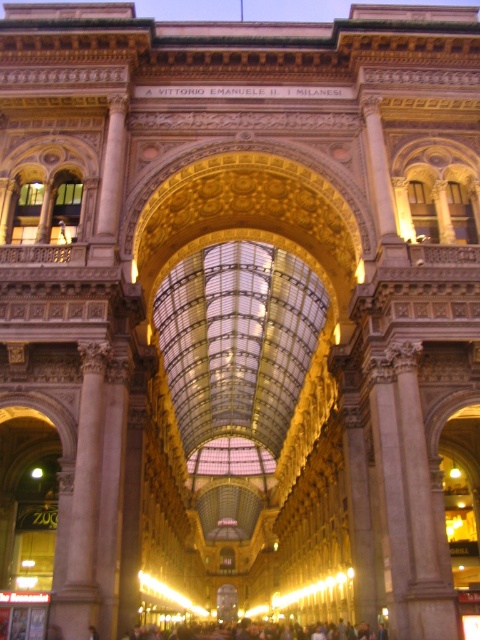
Does white marble column at left have a lesser height compared to dark gray concrete crowd at lower center?

Yes.

This screenshot has height=640, width=480. Find the location of `white marble column at left`. white marble column at left is located at coordinates (84, 506).

Does point (61, 588) come behind point (385, 637)?

No, (61, 588) is closer to viewer.

Image resolution: width=480 pixels, height=640 pixels. In order to click on white marble column at left in this screenshot , I will do `click(84, 506)`.